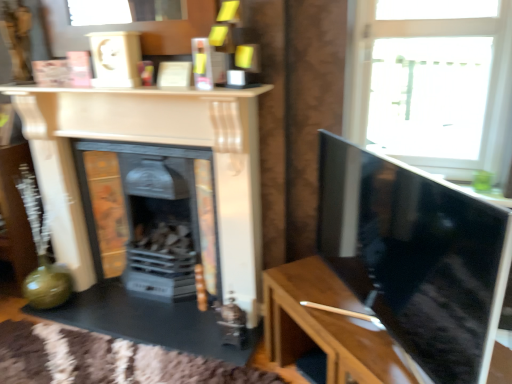
Question: Is transparent glass window at upper right positioned before matte black fireplace at center, positioned as the 1th fireplace in back-to-front order?

Choices:
 (A) yes
 (B) no

Answer: (A)

Question: Would you say transparent glass window at upper right is outside matte black fireplace at center, marked as the 2th fireplace in a front-to-back arrangement?

Choices:
 (A) no
 (B) yes

Answer: (B)

Question: Is matte black fireplace at center, positioned as the 1th fireplace in back-to-front order, completely or partially inside transparent glass window at upper right?

Choices:
 (A) yes
 (B) no

Answer: (B)

Question: Is transparent glass window at upper right taller than matte black fireplace at center, positioned as the 1th fireplace in back-to-front order?

Choices:
 (A) yes
 (B) no

Answer: (B)

Question: Is transparent glass window at upper right not near matte black fireplace at center, positioned as the 1th fireplace in back-to-front order?

Choices:
 (A) yes
 (B) no

Answer: (A)

Question: Can you confirm if transparent glass window at upper right is bigger than matte black fireplace at center, marked as the 2th fireplace in a front-to-back arrangement?

Choices:
 (A) no
 (B) yes

Answer: (A)

Question: Considering the relative sizes of wooden table at right and matte black fireplace at center, marked as the 2th fireplace in a front-to-back arrangement, in the image provided, is wooden table at right bigger than matte black fireplace at center, marked as the 2th fireplace in a front-to-back arrangement,?

Choices:
 (A) yes
 (B) no

Answer: (B)

Question: Is matte black fireplace at center, marked as the 2th fireplace in a front-to-back arrangement, located within wooden table at right?

Choices:
 (A) no
 (B) yes

Answer: (A)

Question: Is there a large distance between wooden table at right and matte black fireplace at center, positioned as the 1th fireplace in back-to-front order?

Choices:
 (A) yes
 (B) no

Answer: (B)

Question: Can we say wooden table at right lies outside matte black fireplace at center, positioned as the 1th fireplace in back-to-front order?

Choices:
 (A) yes
 (B) no

Answer: (A)

Question: Can you confirm if wooden table at right is wider than matte black fireplace at center, positioned as the 1th fireplace in back-to-front order?

Choices:
 (A) no
 (B) yes

Answer: (B)

Question: From the image's perspective, is wooden table at right above matte black fireplace at center, positioned as the 1th fireplace in back-to-front order?

Choices:
 (A) no
 (B) yes

Answer: (A)

Question: Is matte black fireplace at center, marked as the 2th fireplace in a front-to-back arrangement, not inside wooden table at right?

Choices:
 (A) no
 (B) yes

Answer: (B)